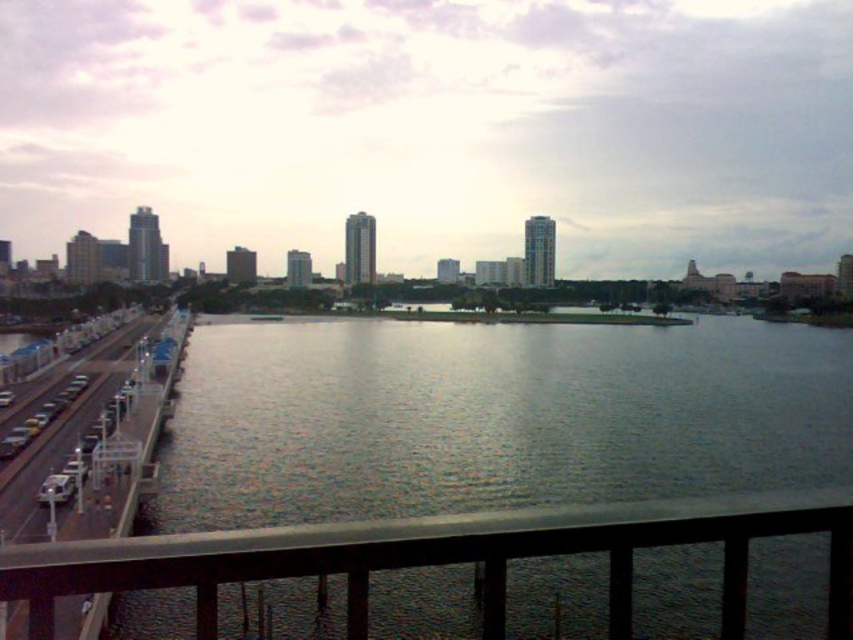
Question: Is gray smooth water at center behind transparent glass railing at lower center?

Choices:
 (A) no
 (B) yes

Answer: (B)

Question: Among these points, which one is nearest to the camera?

Choices:
 (A) tap(68, 550)
 (B) tap(704, 316)

Answer: (A)

Question: Is gray smooth water at center smaller than transparent glass railing at lower center?

Choices:
 (A) yes
 (B) no

Answer: (B)

Question: Which point is farther to the camera?

Choices:
 (A) (344, 552)
 (B) (340, 346)

Answer: (B)

Question: Which point is farther to the camera?

Choices:
 (A) (200, 481)
 (B) (45, 620)

Answer: (A)

Question: Does gray smooth water at center come behind transparent glass railing at lower center?

Choices:
 (A) no
 (B) yes

Answer: (B)